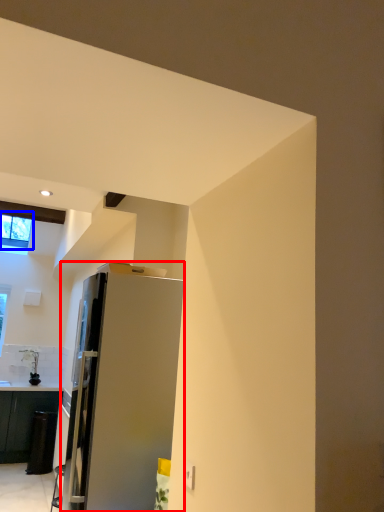
Question: Which point is further to the camera, refrigerator (highlighted by a red box) or window (highlighted by a blue box)?

Choices:
 (A) refrigerator
 (B) window

Answer: (B)